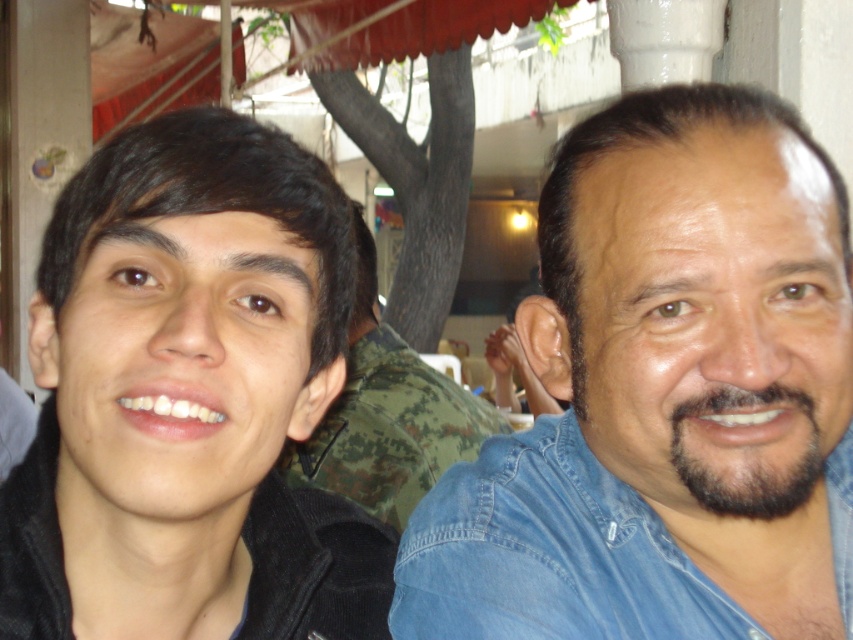
Question: Is blue denim shirt at right to the right of camouflage fabric shirt at center from the viewer's perspective?

Choices:
 (A) no
 (B) yes

Answer: (B)

Question: Estimate the real-world distances between objects in this image. Which object is closer to the blue denim shirt at right?

Choices:
 (A) black matte jacket at left
 (B) camouflage fabric shirt at center

Answer: (A)

Question: Which object is closer to the camera taking this photo?

Choices:
 (A) blue denim shirt at right
 (B) black matte jacket at left

Answer: (B)

Question: Based on their relative distances, which object is farther from the blue denim shirt at right?

Choices:
 (A) camouflage fabric shirt at center
 (B) black matte jacket at left

Answer: (A)

Question: Can you confirm if black matte jacket at left is positioned to the right of camouflage fabric shirt at center?

Choices:
 (A) yes
 (B) no

Answer: (B)

Question: Is blue denim shirt at right smaller than black matte jacket at left?

Choices:
 (A) yes
 (B) no

Answer: (B)